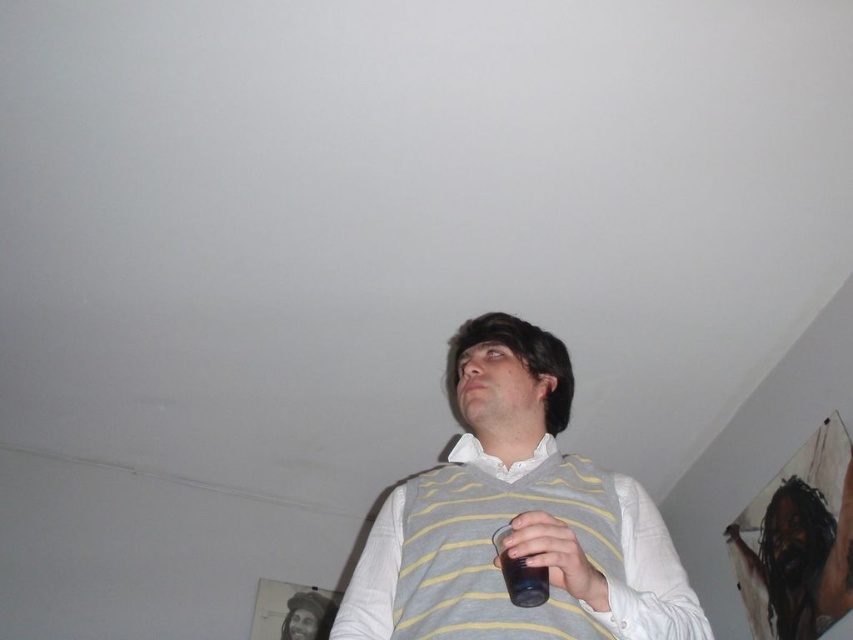
You are a photographer taking a picture of the transparent plastic cup at center. To avoid the yellow striped sweater vest at center from blocking the view, where should you adjust your camera?

The yellow striped sweater vest at center is positioned over the transparent plastic cup at center, so you should move your camera upwards to capture the transparent plastic cup at center without obstruction.